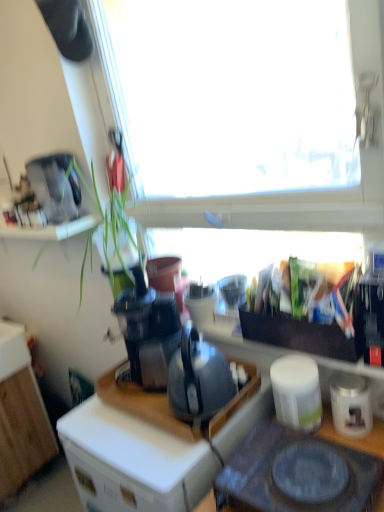
The image size is (384, 512). I want to click on free location above black glass gas stove at lower center (from a real-world perspective), so click(292, 468).